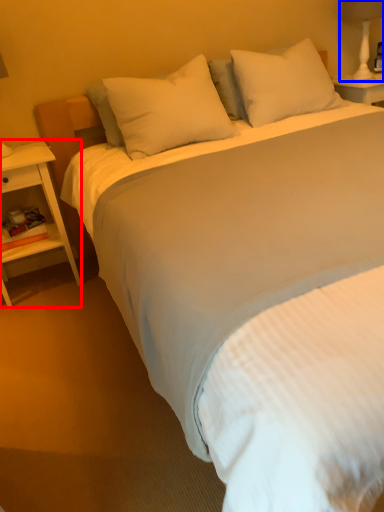
Question: Which object is closer to the camera taking this photo, nightstand (highlighted by a red box) or bedside lamp (highlighted by a blue box)?

Choices:
 (A) nightstand
 (B) bedside lamp

Answer: (A)